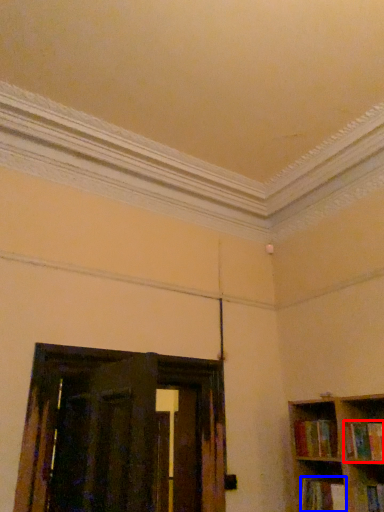
Question: Which point is further to the camera, book (highlighted by a red box) or book (highlighted by a blue box)?

Choices:
 (A) book
 (B) book

Answer: (B)